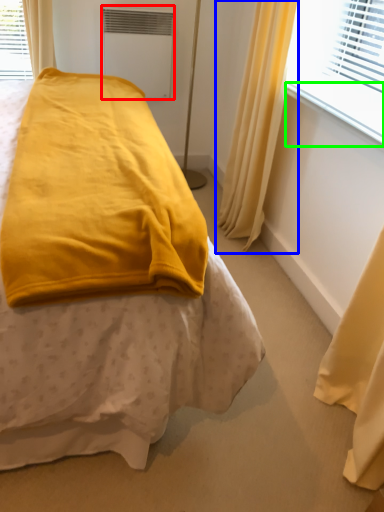
Question: Based on their relative distances, which object is farther from air conditioning (highlighted by a red box)? Choose from curtain (highlighted by a blue box) and window sill (highlighted by a green box).

Choices:
 (A) curtain
 (B) window sill

Answer: (B)